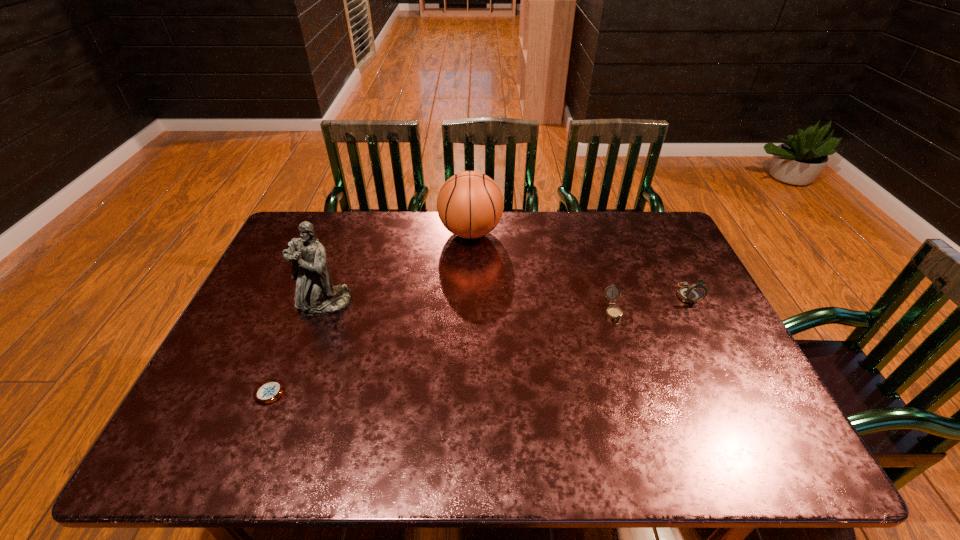
The height and width of the screenshot is (540, 960). Identify the location of free location located on the front of the farthest object. (468, 313).

Identify the location of vacant region located on the face of the rightmost object. (714, 348).

In order to click on free space located on the face of the second compass from right to left in this screenshot , I will do `click(626, 353)`.

Image resolution: width=960 pixels, height=540 pixels. What are the coordinates of `vacant space located 0.310m on the back of the shortest object` in the screenshot? It's located at (310, 292).

The image size is (960, 540). In order to click on object that is at the far edge in this screenshot , I will do `click(470, 204)`.

This screenshot has height=540, width=960. I want to click on figurine positioned at the left edge, so click(315, 295).

Identify the location of compass that is at the left edge. (268, 391).

I want to click on object situated at the right edge, so click(x=691, y=294).

Image resolution: width=960 pixels, height=540 pixels. Identify the location of free space at the far edge. (609, 251).

In the image, there is a desktop. Where is `vacant space at the near edge`? This screenshot has width=960, height=540. vacant space at the near edge is located at coordinates (420, 457).